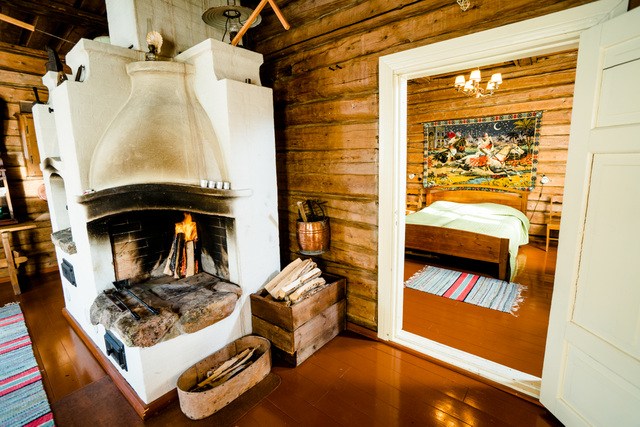
Locate an element on the screen. The height and width of the screenshot is (427, 640). kindling box is located at coordinates (221, 390).